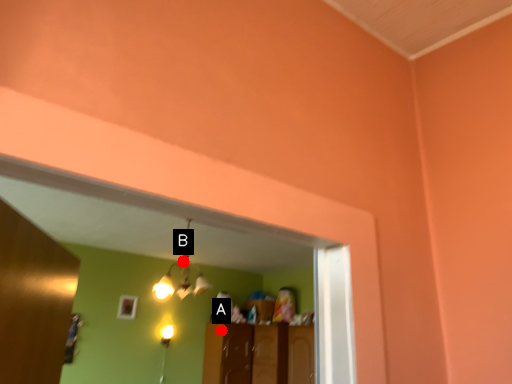
Question: Two points are circled on the image, labeled by A and B beside each circle. Which point appears closest to the camera in this image?

Choices:
 (A) A is closer
 (B) B is closer

Answer: (B)